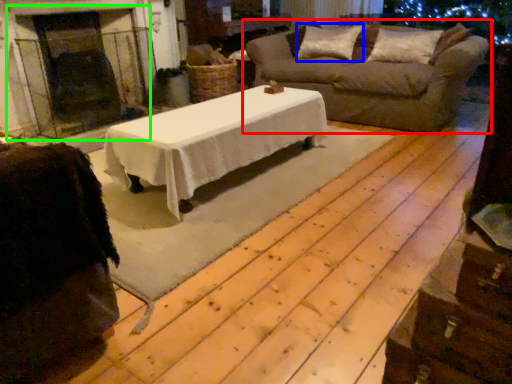
Question: Estimate the real-world distances between objects in this image. Which object is farther from studio sofa (highlighted by a red box), pillow (highlighted by a blue box) or fireplace (highlighted by a green box)?

Choices:
 (A) pillow
 (B) fireplace

Answer: (B)